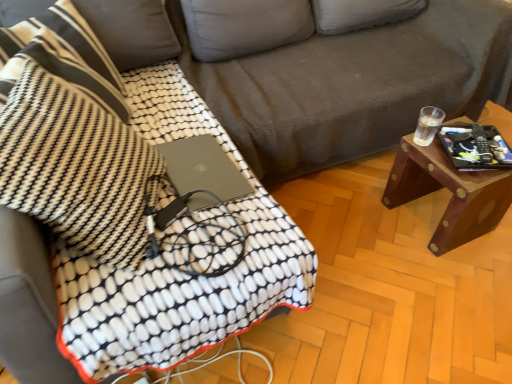
The image size is (512, 384). What are the coordinates of `vacant space situated above woodenmaterial/texturetable at right (from a real-world perspective)` in the screenshot? It's located at (463, 157).